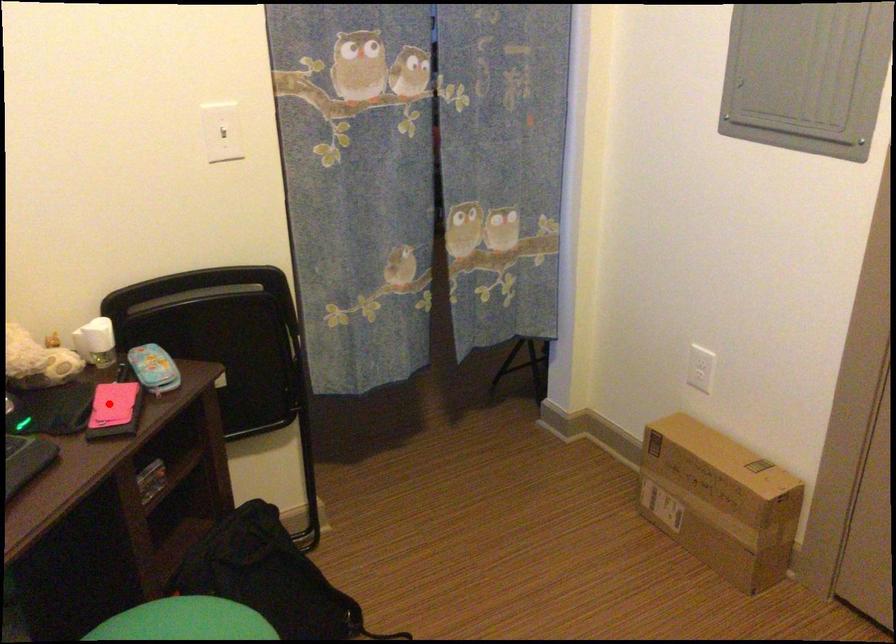
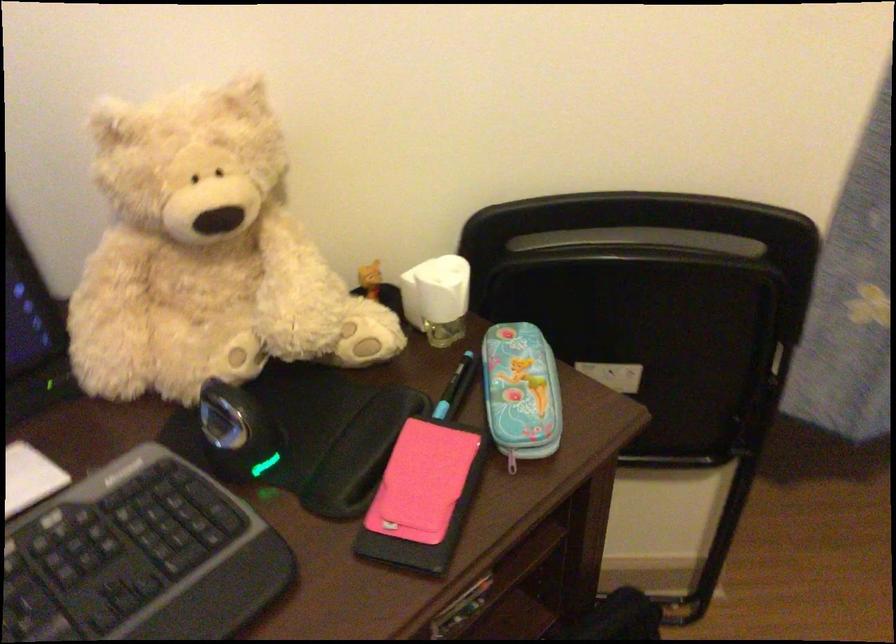
Find the pixel in the second image that matches the highlighted location in the first image.

(421, 482)